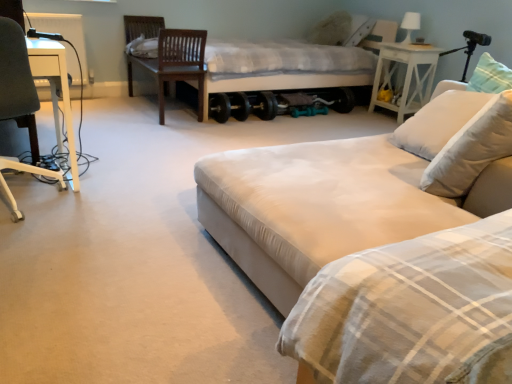
Find the location of a particular element. This screenshot has height=384, width=512. free spot below dark brown wood swivel chair at upper left (from a real-world perspective) is located at coordinates (155, 107).